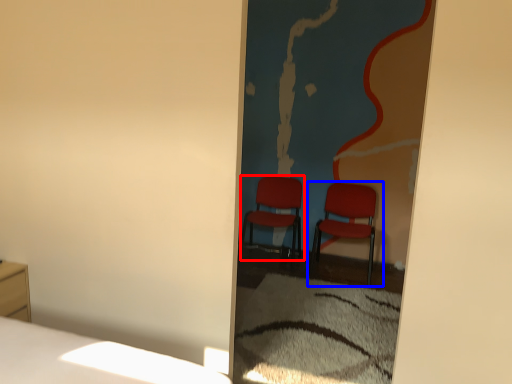
Question: Which object appears farthest to the camera in this image, chair (highlighted by a red box) or chair (highlighted by a blue box)?

Choices:
 (A) chair
 (B) chair

Answer: (A)